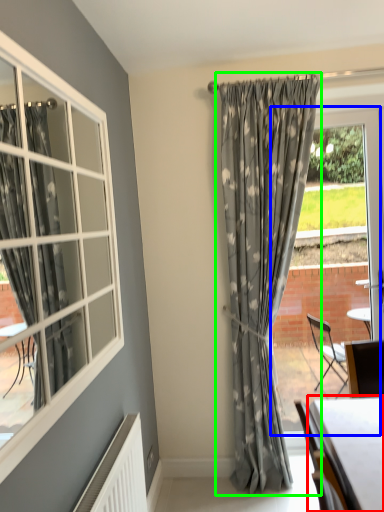
Question: Estimate the real-world distances between objects in this image. Which object is farther from table (highlighted by a red box), window frame (highlighted by a blue box) or curtain (highlighted by a green box)?

Choices:
 (A) window frame
 (B) curtain

Answer: (A)